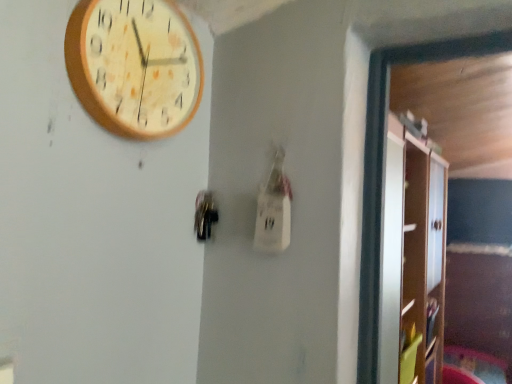
Question: Is wooden clock at upper left surrounding metallic dark gray door handle at center?

Choices:
 (A) yes
 (B) no

Answer: (B)

Question: Is the position of wooden clock at upper left more distant than that of metallic dark gray door handle at center?

Choices:
 (A) yes
 (B) no

Answer: (B)

Question: Is wooden clock at upper left looking in the opposite direction of metallic dark gray door handle at center?

Choices:
 (A) yes
 (B) no

Answer: (B)

Question: Are wooden clock at upper left and metallic dark gray door handle at center far apart?

Choices:
 (A) no
 (B) yes

Answer: (A)

Question: Does wooden clock at upper left have a lesser height compared to metallic dark gray door handle at center?

Choices:
 (A) no
 (B) yes

Answer: (A)

Question: Is wooden clock at upper left wider than metallic dark gray door handle at center?

Choices:
 (A) no
 (B) yes

Answer: (B)

Question: From a real-world perspective, does white glossy cabinet at right stand above wooden clock at upper left?

Choices:
 (A) yes
 (B) no

Answer: (B)

Question: Is white glossy cabinet at right shorter than wooden clock at upper left?

Choices:
 (A) yes
 (B) no

Answer: (B)

Question: Is wooden clock at upper left at the back of white glossy cabinet at right?

Choices:
 (A) yes
 (B) no

Answer: (B)

Question: Can you confirm if white glossy cabinet at right is smaller than wooden clock at upper left?

Choices:
 (A) no
 (B) yes

Answer: (A)

Question: Is white glossy cabinet at right thinner than wooden clock at upper left?

Choices:
 (A) no
 (B) yes

Answer: (A)

Question: Considering the relative sizes of white glossy cabinet at right and wooden clock at upper left in the image provided, is white glossy cabinet at right taller than wooden clock at upper left?

Choices:
 (A) yes
 (B) no

Answer: (A)

Question: From a real-world perspective, is wooden clock at upper left physically above white glossy cabinet at right?

Choices:
 (A) no
 (B) yes

Answer: (B)